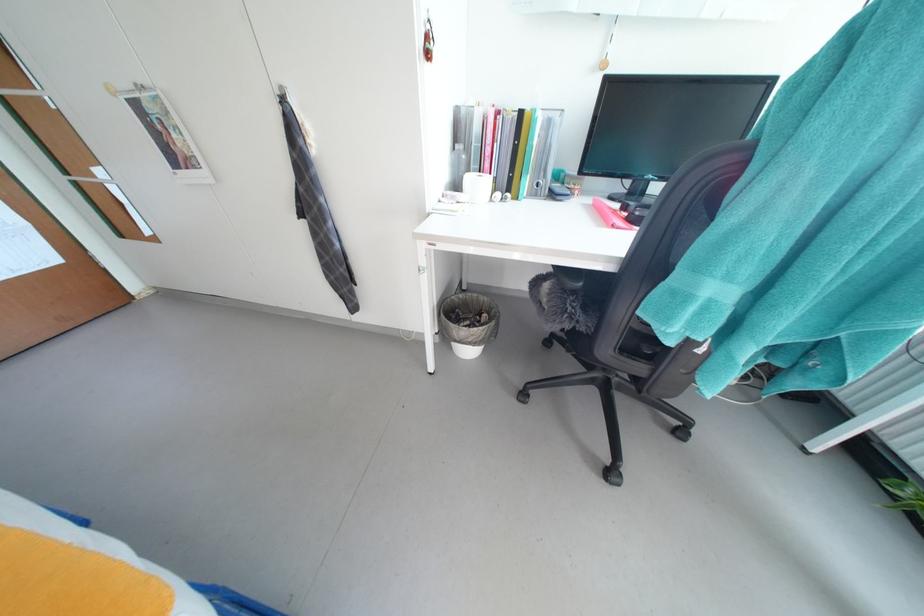
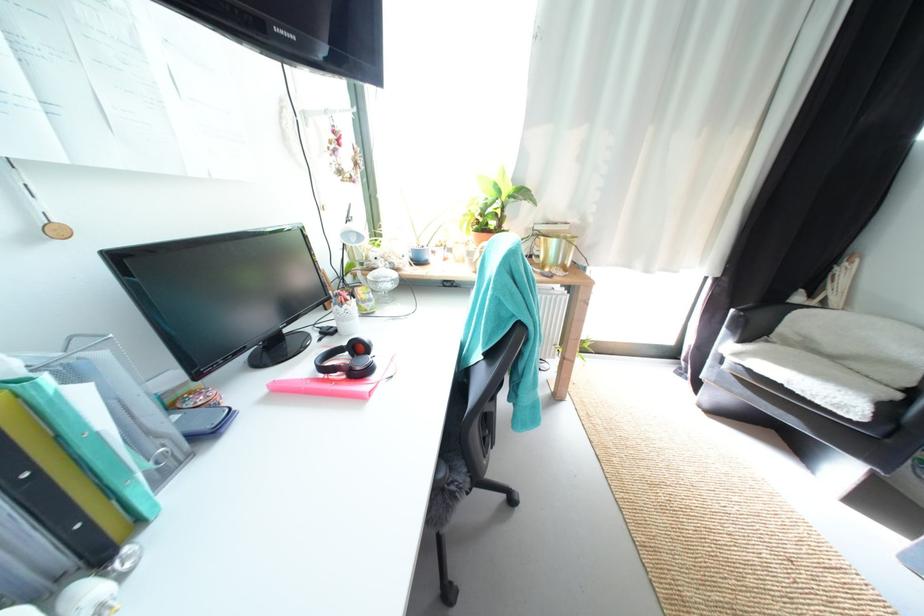
Where in the second image is the point corresponding to (x=602, y=201) from the first image?

(275, 387)